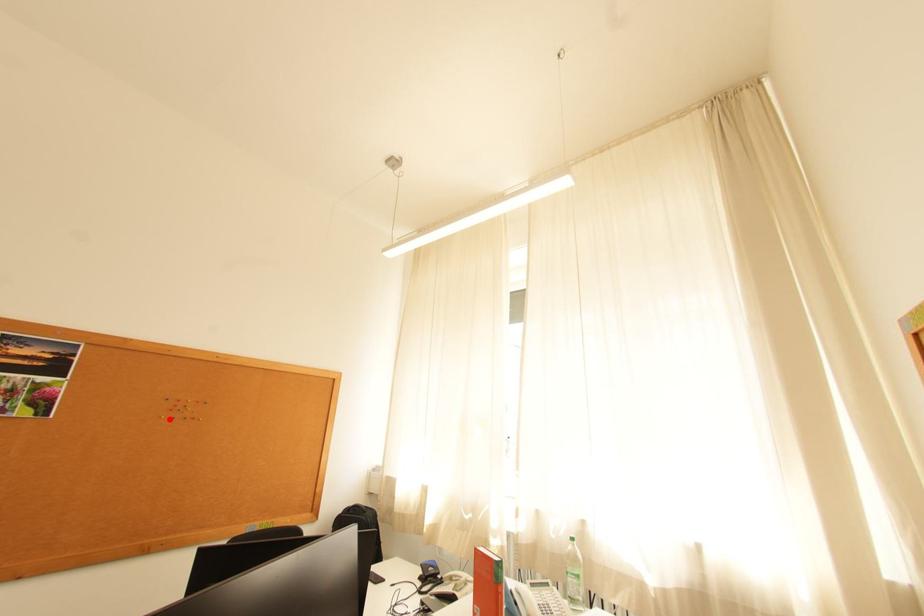
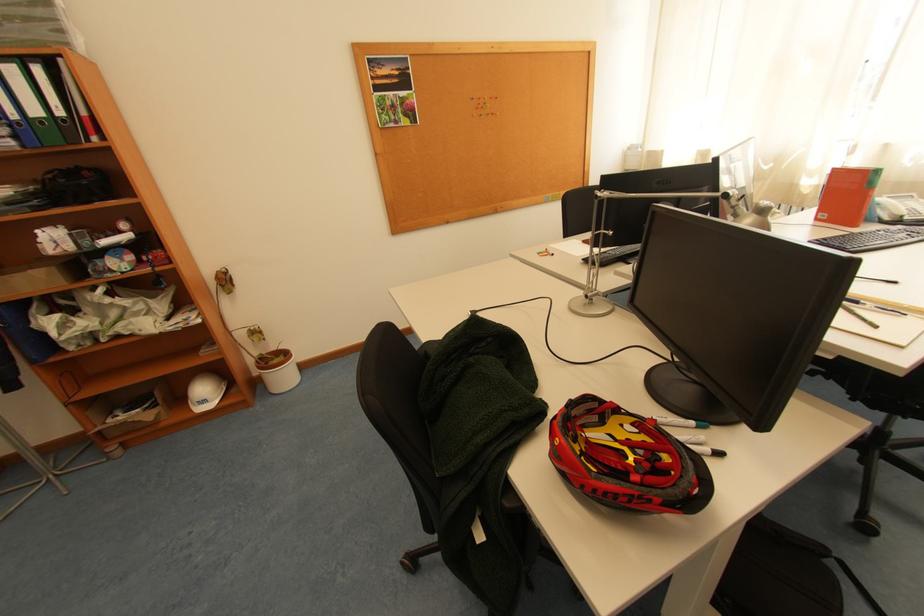
Locate, in the second image, the point that corresponds to the highlighted location in the first image.

(481, 118)